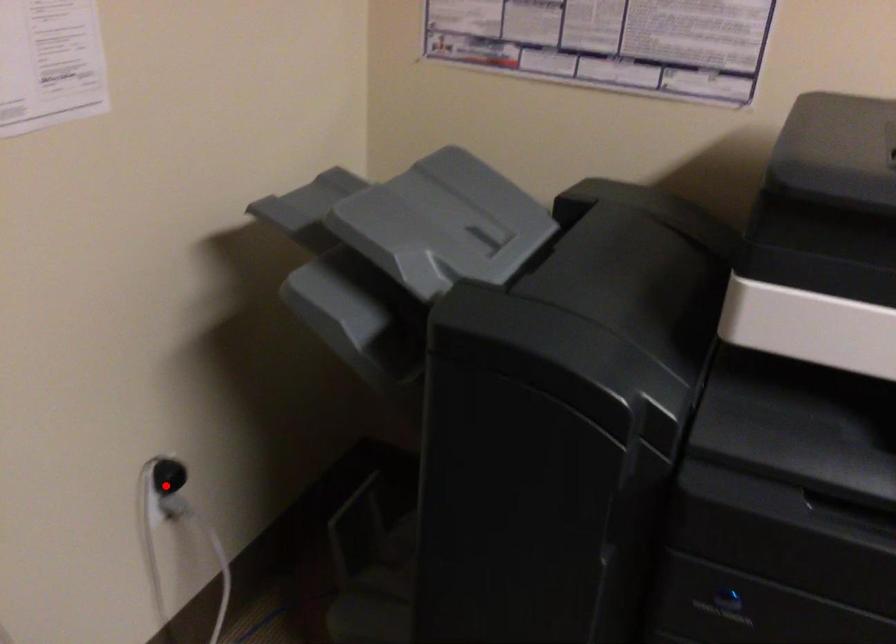
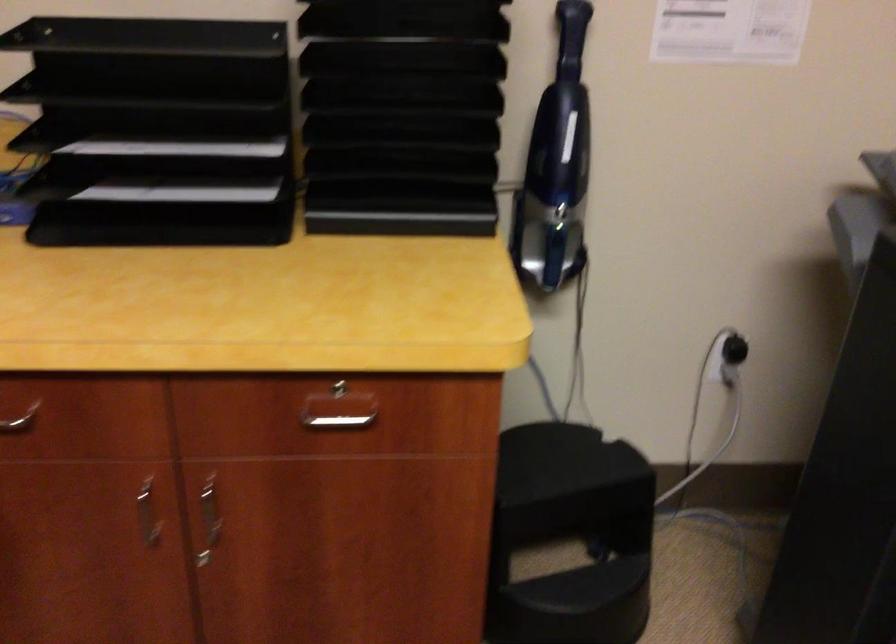
The point at the highlighted location is marked in the first image. Where is the corresponding point in the second image?

(730, 357)